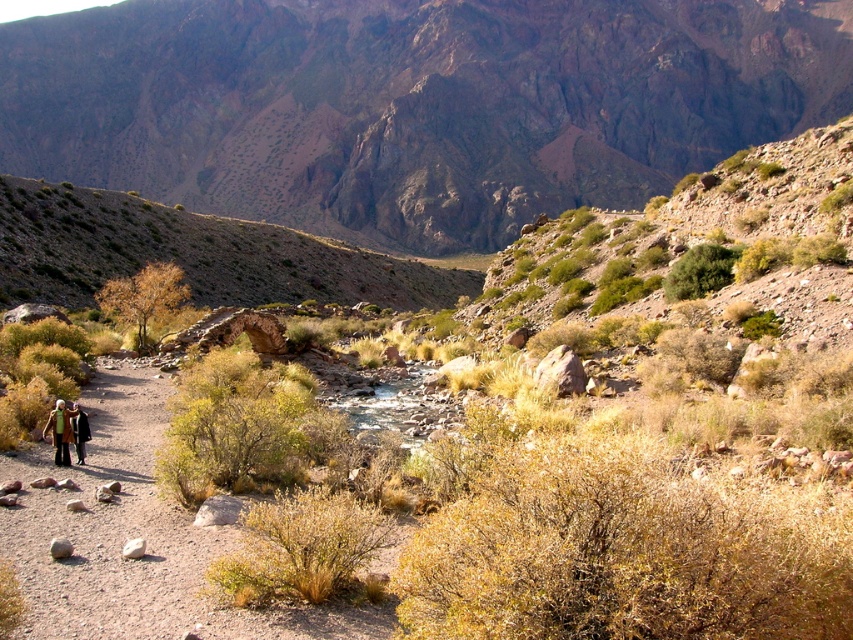
You are navigating through the arid landscape and see two points marked on your map. The first is point (399, 244) and the second is point (158, 273). If you are facing the direction of the stream, which point is closer to you?

Point (158, 273) is closer to you because it is in front of point (399, 244) when facing the stream.

You are standing at the starting point of the dirt path in the foreground and want to reach the rugged rock mountain at upper center. Which direction should you head to reach it?

The rugged rock mountain at upper center is located at point (412, 104), so you should head towards the upper center direction to reach it.